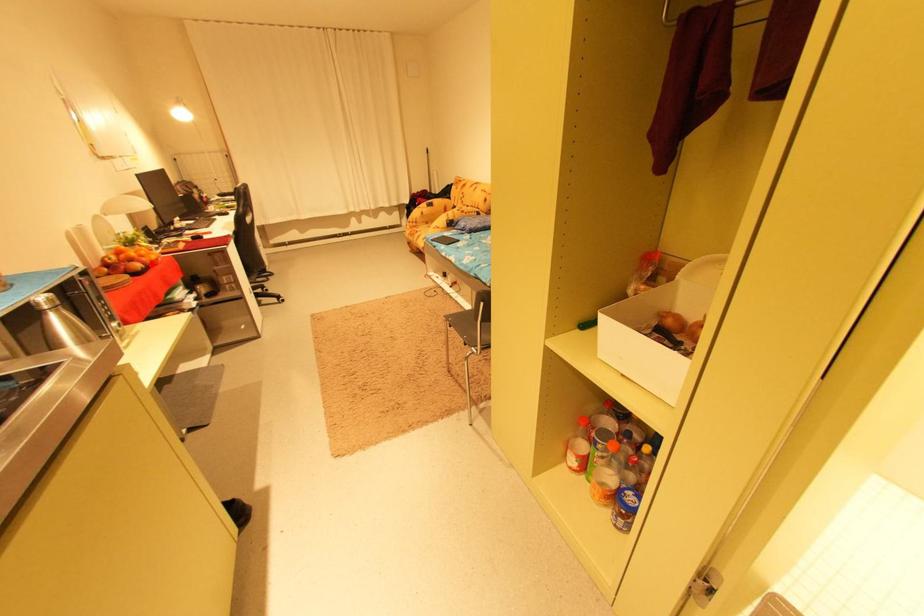
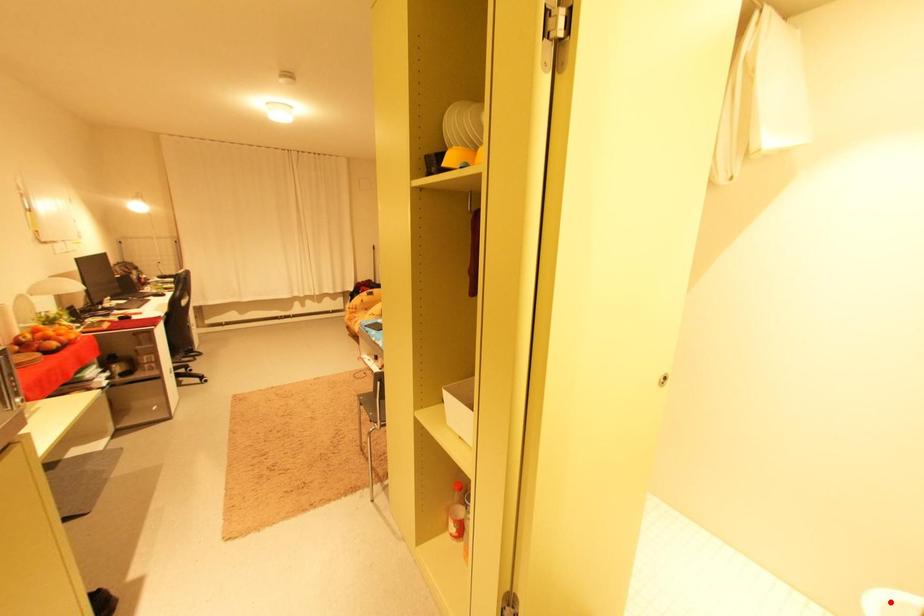
I am providing you with two images of the same scene from different viewpoints. A red point is marked on the first image and another point is marked on the second image. Is the red point in image1 aligned with the point shown in image2?

No